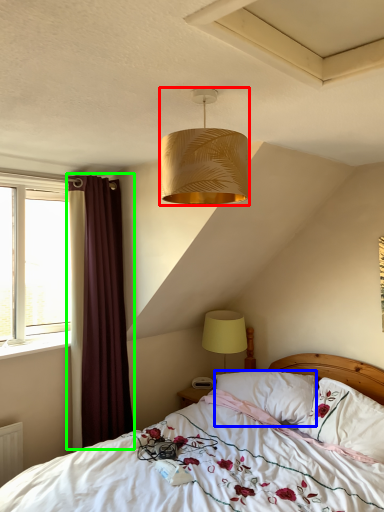
Question: Which object is positioned farthest from lamp (highlighted by a red box)? Select from pillow (highlighted by a blue box) and curtain (highlighted by a green box).

Choices:
 (A) pillow
 (B) curtain

Answer: (A)